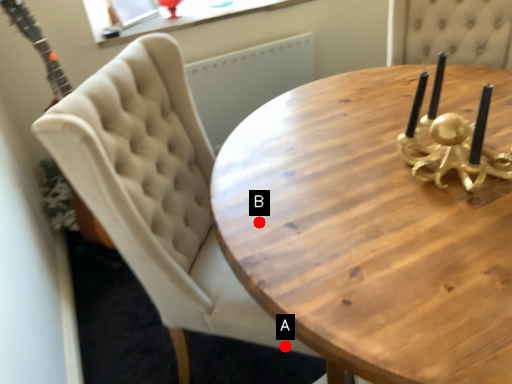
Question: Two points are circled on the image, labeled by A and B beside each circle. Which point is closer to the camera?

Choices:
 (A) A is closer
 (B) B is closer

Answer: (B)